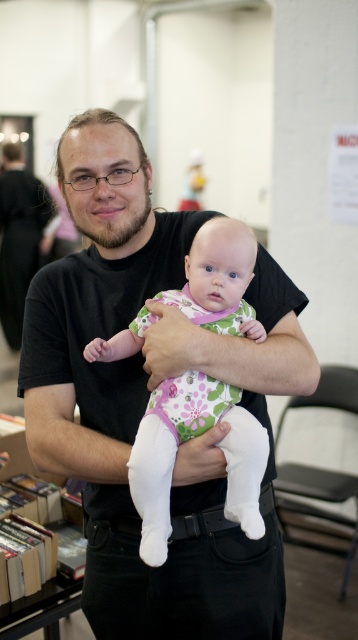
You are a photographer trying to capture a closeup of the black matte shirt at center and the hardcover books at left in the scene. Given that your camera has a maximum focus range of 25 inches, will you be able to focus on both subjects simultaneously?

The black matte shirt at center and hardcover books at left are 25.55 inches apart from each other. Since the distance between them exceeds the camera focus range of 25 inches, you cannot focus on both subjects simultaneously.

You are a photographer trying to capture a closeup of the black matte shirt at center and the floral cotton onesie at center. If you want to ensure both are fully visible in the frame, which one should you focus on first considering their sizes?

The black matte shirt at center might be wider than floral cotton onesie at center, so you should focus on the black matte shirt at center first to ensure it fits in the frame.